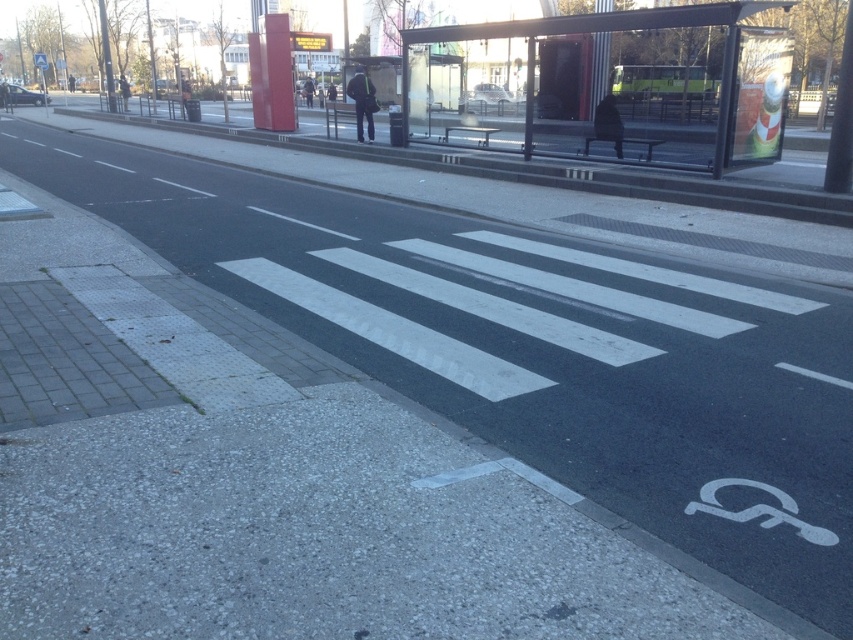
Question: Among these points, which one is farthest from the camera?

Choices:
 (A) (154, 120)
 (B) (608, 109)

Answer: (A)

Question: Is black fabric person at upper center to the right of black fabric jacket at center from the viewer's perspective?

Choices:
 (A) no
 (B) yes

Answer: (B)

Question: Which object appears closest to the camera in this image?

Choices:
 (A) gray concrete curb at center
 (B) black leather jacket at upper center
 (C) black fabric person at upper center

Answer: (A)

Question: Is transparent glass bus stop at upper center smaller than black leather jacket at upper center?

Choices:
 (A) yes
 (B) no

Answer: (A)

Question: Does transparent glass bus stop at upper center come behind black fabric person at upper center?

Choices:
 (A) no
 (B) yes

Answer: (A)

Question: Which object is farther from the camera taking this photo?

Choices:
 (A) black leather jacket at upper center
 (B) transparent glass bus stop at upper center
 (C) gray concrete curb at center
 (D) black fabric jacket at center

Answer: (D)